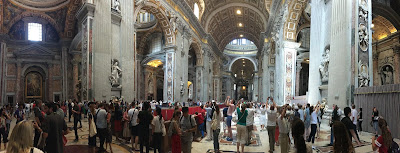
The height and width of the screenshot is (153, 400). I want to click on windows, so click(30, 33), click(196, 9), click(235, 39), click(244, 41), click(252, 42), click(235, 85), click(252, 87).